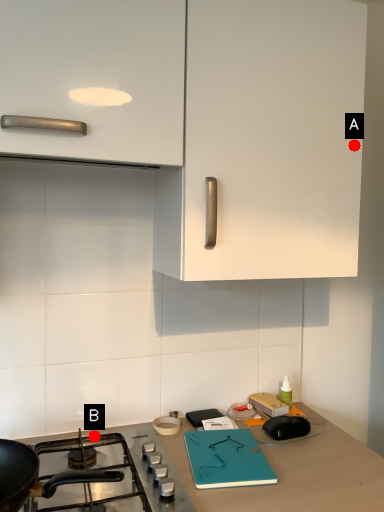
Question: Two points are circled on the image, labeled by A and B beside each circle. Which point appears closest to the camera in this image?

Choices:
 (A) A is closer
 (B) B is closer

Answer: (B)